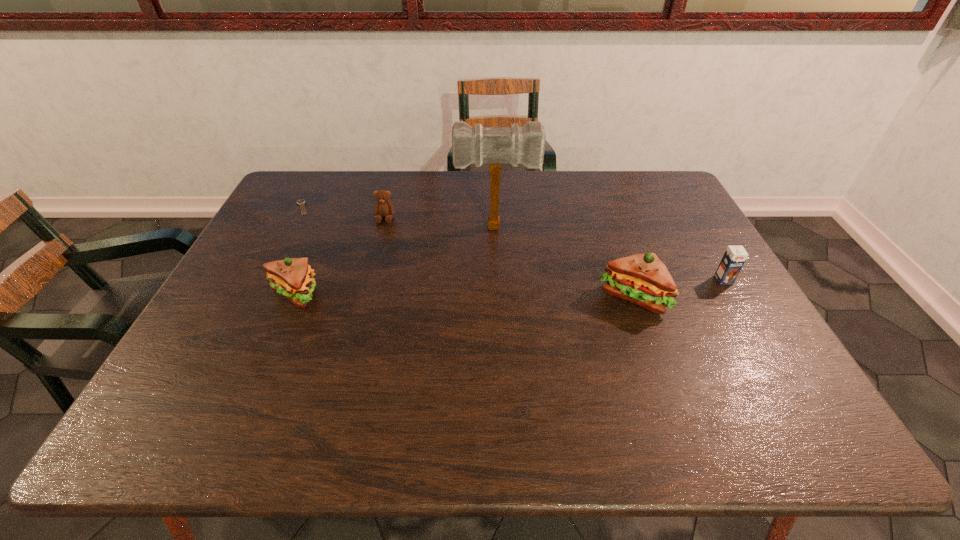
The height and width of the screenshot is (540, 960). I want to click on vacant area located on the left of the taller sandwich, so (531, 298).

Find the location of a particular element. free space located 0.270m on the back of the mallet is located at coordinates (493, 177).

Image resolution: width=960 pixels, height=540 pixels. Identify the location of vacant region located 0.330m on the face of the teddy bear. (363, 300).

At what (x,y) coordinates should I click in order to perform the action: click on free space located on the right of the watch. Please return your answer as a coordinate pair (x, y). The image size is (960, 540). Looking at the image, I should click on (399, 207).

The height and width of the screenshot is (540, 960). In order to click on vacant space positioned on the front label of the chocolate milk in this screenshot , I will do `click(744, 315)`.

What are the coordinates of `object located in the far edge section of the desktop` in the screenshot? It's located at (301, 202).

You are a GUI agent. You are given a task and a screenshot of the screen. Output one action in this format:
    pyautogui.click(x=<x>, y=<y>)
    Task: Click on the sandwich located at the left edge
    Image resolution: width=960 pixels, height=540 pixels.
    Given the screenshot: What is the action you would take?
    pyautogui.click(x=292, y=278)

The image size is (960, 540). I want to click on watch present at the left edge, so click(301, 202).

Locate an element on the screen. object at the right edge is located at coordinates (734, 258).

Identify the location of object situated at the far left corner. (301, 202).